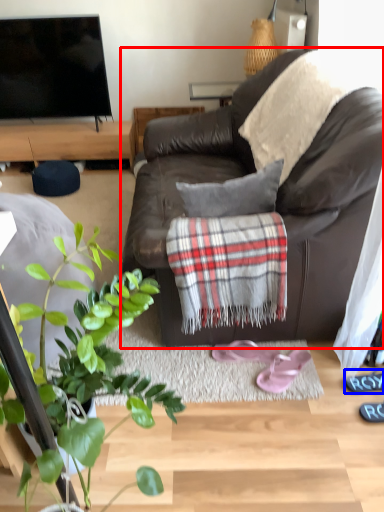
Question: Which point is closer to the camera, studio couch (highlighted by a red box) or shoe (highlighted by a blue box)?

Choices:
 (A) studio couch
 (B) shoe

Answer: (A)